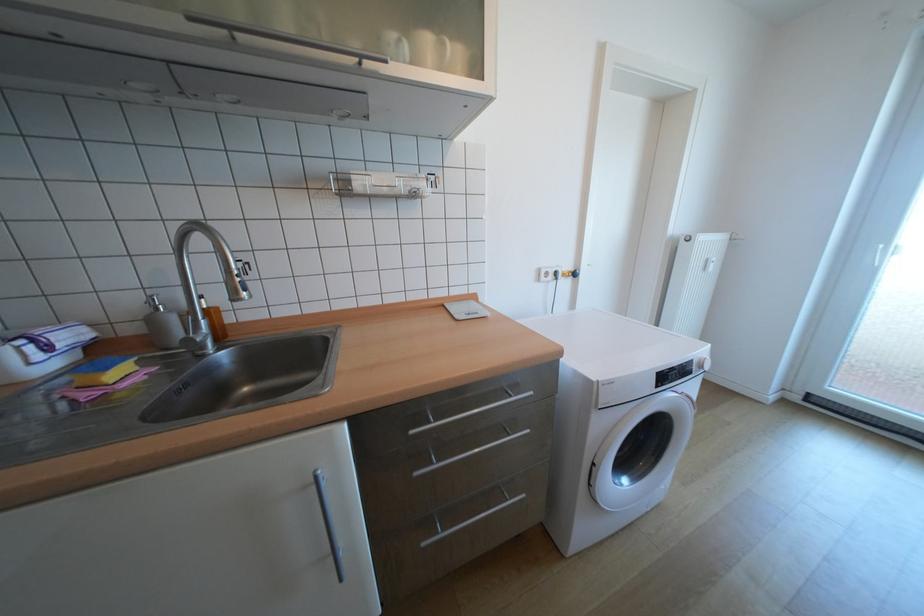
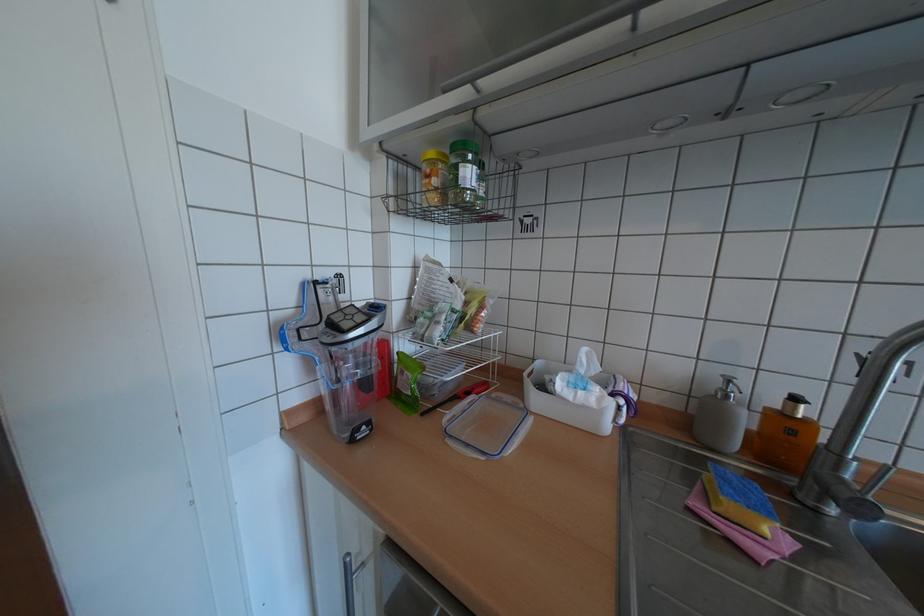
Question: Based on the continuous images, in which direction is the camera rotating? Reply with the corresponding letter.

Choices:
 (A) Left
 (B) Right
 (C) Up
 (D) Down

Answer: (A)